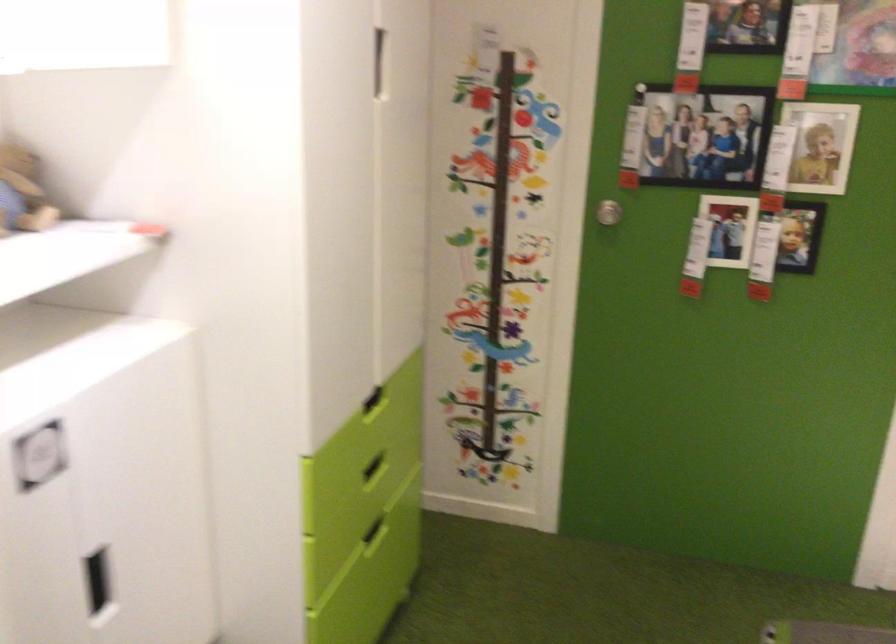
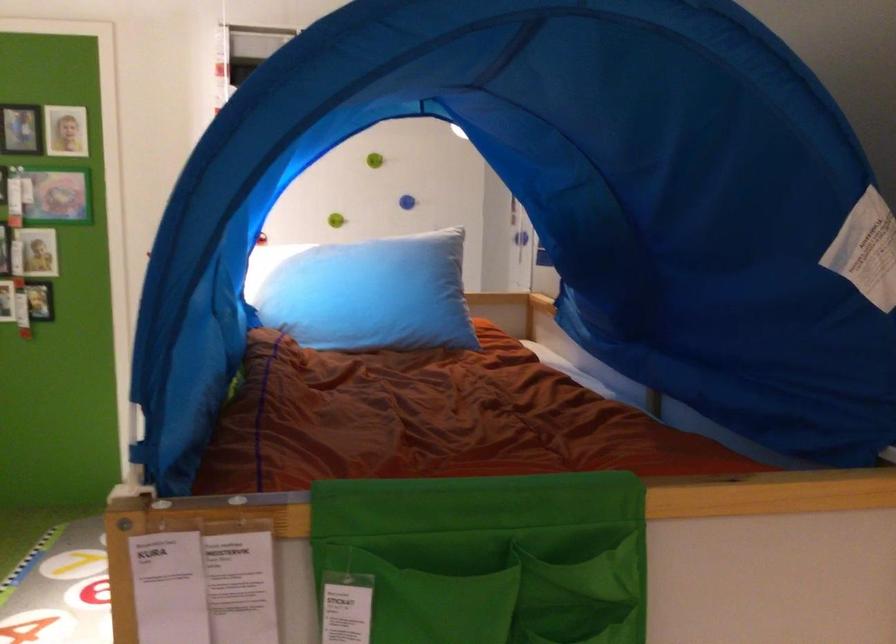
Locate, in the second image, the point that corresponds to pixel 817 118 in the first image.

(39, 251)